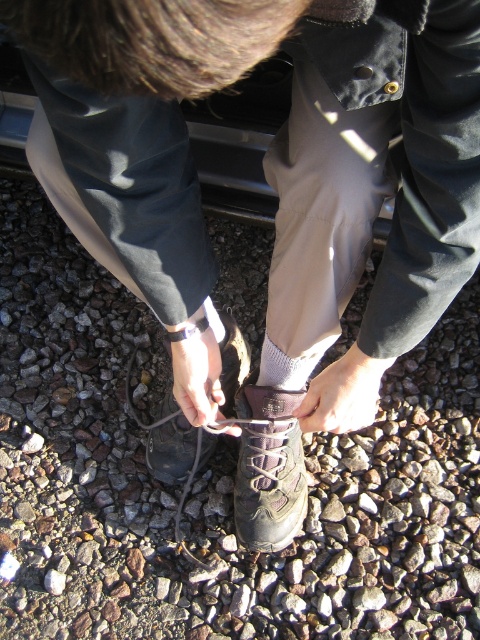
You are standing at point (240, 140). What object is located at this point?

The metallic gray car at center is located at point (240, 140).

You are trying to take a photo of the brown suede boot at center but need to avoid the gray gravel at center appearing in the foreground. Based on their positions, can you position yourself so that the boot is in focus while the gravel is out of frame?

The gray gravel at center is closer to the viewer than brown suede boot at center. To avoid the gravel appearing in the foreground, position yourself so that the boot is framed without the gravel. Since the gravel is closer, moving the camera angle upward or shifting sideways might help isolate the boot while keeping the gravel out of the shot.